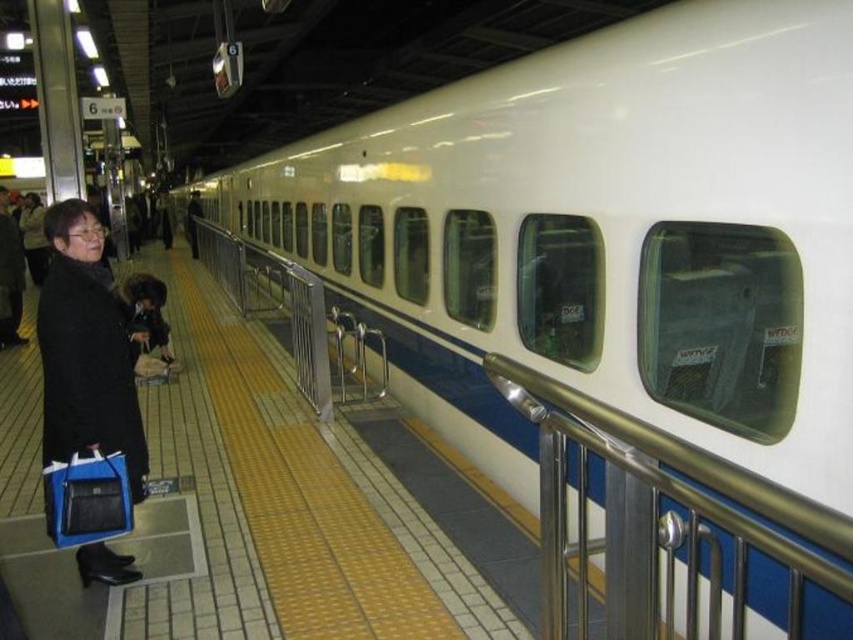
Looking at this image, you are a passenger standing on the platform and want to check your coat to ensure it doesn not get caught in the satin silver railing at center while boarding the train. Given the position of the black matte coat at left relative to the railing, is there a risk that the coat might get caught?

The satin silver railing at center is positioned under the black matte coat at left, meaning the coat is above the railing. Since the railing is below the coat, there is no risk of the coat getting caught in the railing during boarding.

Looking at this image, you are a passenger at the train station and need to determine if your small backpack can fit through the space between the satin silver railing at center and the black matte coat at left. Based on their sizes, can your backpack pass through?

The satin silver railing at center has a larger size compared to the black matte coat at left. Since the railing is larger, the space between them might be narrower. However, without knowing the exact dimensions of your backpack, it is difficult to determine if it can pass through. Consider measuring your backpack against the space available.